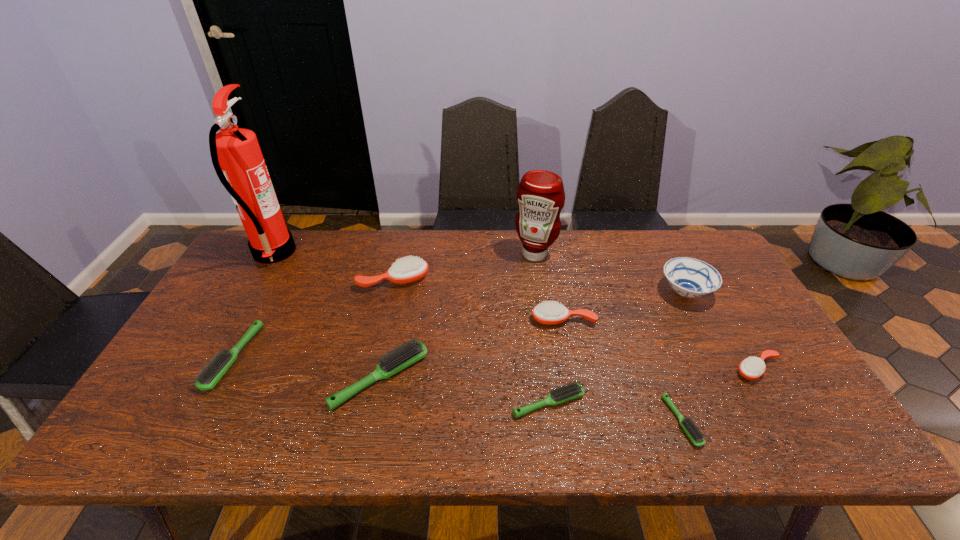
Find the location of a particular element. The height and width of the screenshot is (540, 960). hairbrush that is at the far edge is located at coordinates (411, 269).

I want to click on fire extinguisher that is at the left edge, so click(x=235, y=152).

Where is `hairbrush present at the left edge`? Image resolution: width=960 pixels, height=540 pixels. hairbrush present at the left edge is located at coordinates (211, 374).

This screenshot has width=960, height=540. Identify the location of soup bowl situated at the right edge. (689, 277).

The height and width of the screenshot is (540, 960). I want to click on hairbrush located at the right edge, so click(x=751, y=368).

The image size is (960, 540). In order to click on object that is at the far left corner in this screenshot , I will do `click(235, 152)`.

Find the location of `free spot at the far edge of the desktop`. free spot at the far edge of the desktop is located at coordinates (496, 249).

Locate an element on the screen. The height and width of the screenshot is (540, 960). vacant space at the near edge of the desktop is located at coordinates (312, 415).

Locate an element on the screen. Image resolution: width=960 pixels, height=540 pixels. vacant position at the left edge of the desktop is located at coordinates (231, 293).

Locate an element on the screen. The height and width of the screenshot is (540, 960). blank area at the right edge is located at coordinates (746, 295).